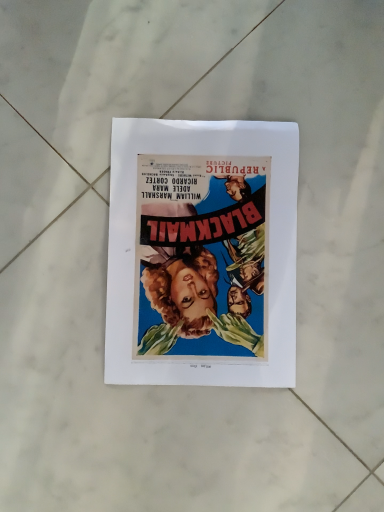
Image resolution: width=384 pixels, height=512 pixels. What do you see at coordinates (202, 253) in the screenshot? I see `matte paper poster at center` at bounding box center [202, 253].

In order to click on matte paper poster at center in this screenshot , I will do `click(202, 253)`.

Locate an element on the screen. The image size is (384, 512). matte paper poster at center is located at coordinates (202, 253).